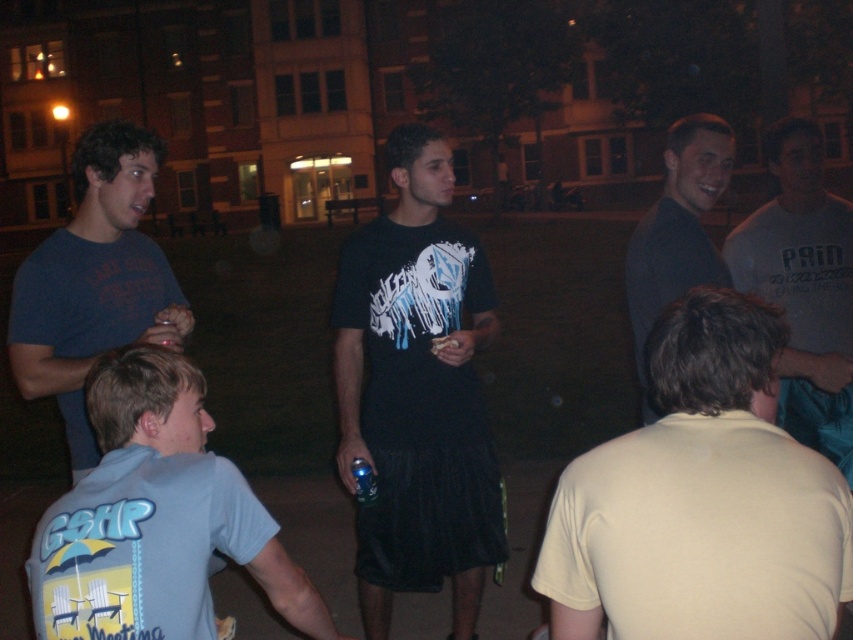
Is black matte t-shirt at center behind light blue t-shirt at lower left?

Yes, it is behind light blue t-shirt at lower left.

Find the location of a particular element. The image size is (853, 640). black matte t-shirt at center is located at coordinates pos(416,392).

Does matte blue t-shirt at left have a smaller size compared to blue plastic cup at center?

No, matte blue t-shirt at left is not smaller than blue plastic cup at center.

Is matte blue t-shirt at left in front of blue plastic cup at center?

Yes, matte blue t-shirt at left is closer to the viewer.

Does point (86, 320) lie in front of point (368, 492)?

Yes, it is.

The width and height of the screenshot is (853, 640). In order to click on matte blue t-shirt at left in this screenshot , I will do `click(94, 282)`.

Can you confirm if yellow matte shirt at center is positioned below matte blue t-shirt at left?

Yes.

Is point (809, 604) behind point (149, 285)?

No, it is not.

Find the location of a particular element. The height and width of the screenshot is (640, 853). yellow matte shirt at center is located at coordinates (701, 499).